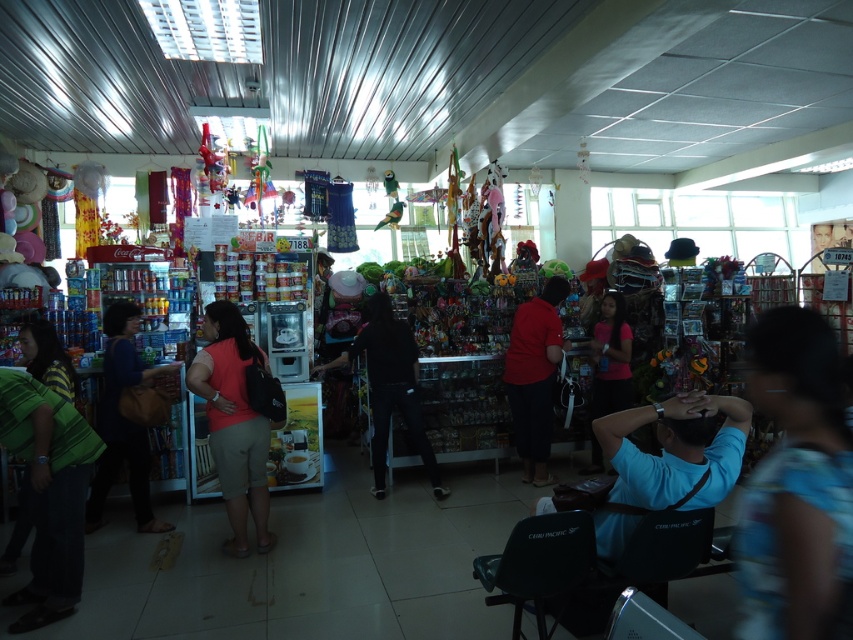
Question: Is matte blue shirt at left below black matte shirt at center?

Choices:
 (A) yes
 (B) no

Answer: (A)

Question: Which object appears closest to the camera in this image?

Choices:
 (A) blue fabric shirt at right
 (B) red matte shirt at center
 (C) black matte shirt at center
 (D) matte blue shirt at left

Answer: (A)

Question: Which point is closer to the camera taking this photo?

Choices:
 (A) (538, 428)
 (B) (772, 509)
 (C) (381, 387)
 (D) (126, 387)

Answer: (B)

Question: Is black matte shirt at center thinner than pink matte shirt at center?

Choices:
 (A) yes
 (B) no

Answer: (B)

Question: Which of the following is the farthest from the observer?

Choices:
 (A) (421, 413)
 (B) (241, 496)
 (C) (616, 408)
 (D) (157, 525)

Answer: (C)

Question: Does matte pink shirt at center appear on the left side of matte blue shirt at left?

Choices:
 (A) no
 (B) yes

Answer: (A)